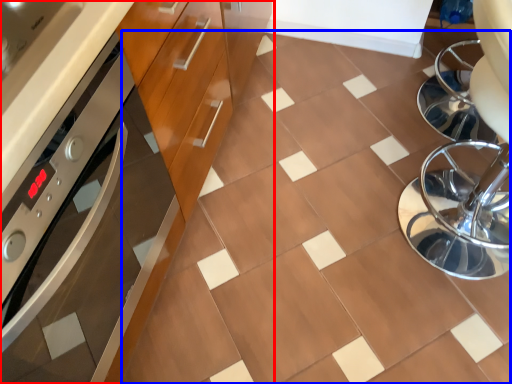
Question: Which of the following is the farthest to the observer, cabinetry (highlighted by a red box) or ceramic tile (highlighted by a blue box)?

Choices:
 (A) cabinetry
 (B) ceramic tile

Answer: (B)